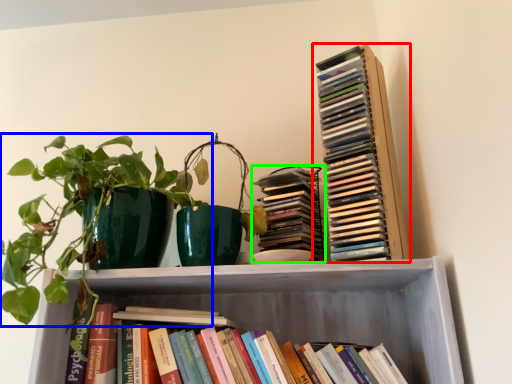
Question: Which object is the closest to the book (highlighted by a red box)? Choose among these: houseplant (highlighted by a blue box) or book (highlighted by a green box).

Choices:
 (A) houseplant
 (B) book

Answer: (B)